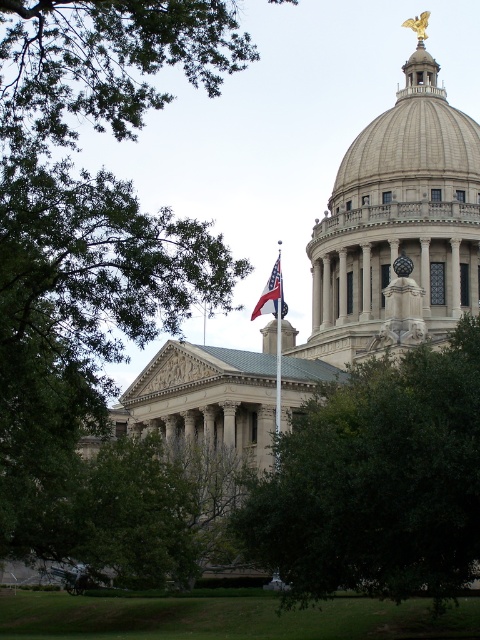
You are a photographer planning to take a photo of the American flag at center in front of the state capitol building. You want to ensure the green leafy tree at upper left doesn not block the flag in the shot. Based on their sizes, is the tree likely to overshadow the flag?

The green leafy tree at upper left is wider than the american flag at center, so it may overshadow the flag in the photo.

You are standing in front of the grand neoclassical building and want to walk towards the green leafy tree at center. Which direction should you walk to avoid passing by the green leafy tree at upper left?

Since the green leafy tree at center is closer to you than the green leafy tree at upper left, you should walk directly towards the green leafy tree at center without needing to detour around the tree at upper left, which is farther away.

You are a landscape architect planning to install a new pathway between the green leafy tree at center and the green leafy tree at upper left. What is the minimum width the pathway should be to ensure a 2 meter buffer on both sides of the trees?

The green leafy tree at center and green leafy tree at upper left are 22.39 meters apart. To ensure a 2 meter buffer on both sides, the pathway should be at least 22.39 meters plus 4 meters, totaling 26.39 meters in length.